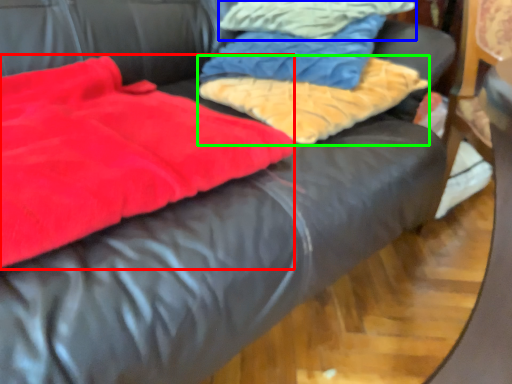
Question: Based on their relative distances, which object is farther from blanket (highlighted by a red box)? Choose from cloth (highlighted by a blue box) and cloth (highlighted by a green box).

Choices:
 (A) cloth
 (B) cloth

Answer: (A)